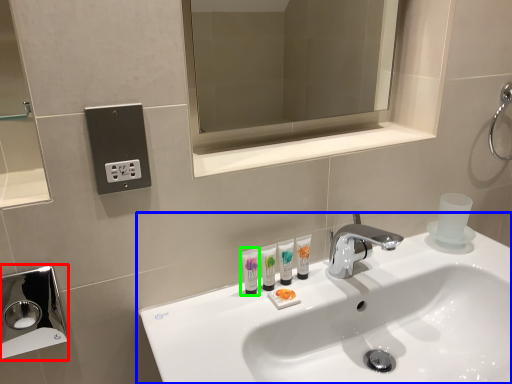
Question: Based on their relative distances, which object is nearer to hand dryer (highlighted by a red box)? Choose from sink (highlighted by a blue box) and mouthwash (highlighted by a green box).

Choices:
 (A) sink
 (B) mouthwash

Answer: (A)